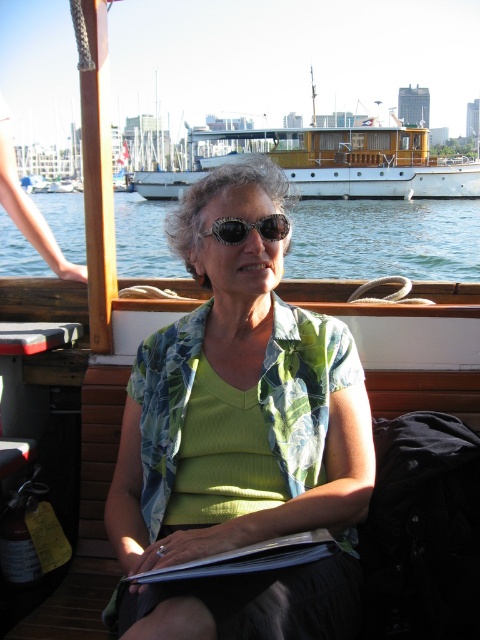
Question: Which object is closer to the camera taking this photo?

Choices:
 (A) green fabric shirt at center
 (B) shiny black sunglasses at center
 (C) blue water at center

Answer: (A)

Question: Can you confirm if green fabric shirt at center is positioned above wooden polished boat at upper center?

Choices:
 (A) yes
 (B) no

Answer: (B)

Question: Can you confirm if green fabric shirt at center is positioned to the left of wooden polished boat at upper center?

Choices:
 (A) yes
 (B) no

Answer: (A)

Question: Among these points, which one is farthest from the camera?

Choices:
 (A) (271, 140)
 (B) (162, 202)

Answer: (A)

Question: Which point is closer to the camera?

Choices:
 (A) white paper book at center
 (B) shiny black sunglasses at center
 (C) blue water at center

Answer: (A)

Question: Can you confirm if green fabric shirt at center is smaller than shiny black sunglasses at center?

Choices:
 (A) yes
 (B) no

Answer: (B)